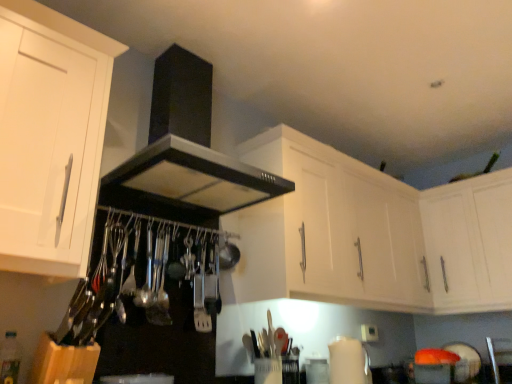
Measure the distance between point (x=495, y=269) and camera.

2.54 meters.

The width and height of the screenshot is (512, 384). What do you see at coordinates (50, 137) in the screenshot?
I see `white matte cabinet at left, the 3th cabinetry from the right` at bounding box center [50, 137].

The width and height of the screenshot is (512, 384). What are the coordinates of `white matte cabinet at left, which ranks as the first cabinetry in left-to-right order` in the screenshot? It's located at (50, 137).

What do you see at coordinates (370, 235) in the screenshot? I see `white matte cabinet at upper center, placed as the second cabinetry when sorted from right to left` at bounding box center [370, 235].

Where is `white matte cabinet at upper right, which appears as the 3th cabinetry when viewed from the left`? The width and height of the screenshot is (512, 384). white matte cabinet at upper right, which appears as the 3th cabinetry when viewed from the left is located at coordinates (469, 243).

Locate an element on the screen. The width and height of the screenshot is (512, 384). exhaust hood above the satin nickel spatula at center (from a real-world perspective) is located at coordinates (188, 146).

From the image's perspective, does black matte exhaust hood at upper center appear lower than satin nickel spatula at center?

No.

Is black matte exhaust hood at upper center wider than satin nickel spatula at center?

Yes, black matte exhaust hood at upper center is wider than satin nickel spatula at center.

Considering the relative sizes of black matte exhaust hood at upper center and satin nickel spatula at center in the image provided, is black matte exhaust hood at upper center taller than satin nickel spatula at center?

Indeed, black matte exhaust hood at upper center has a greater height compared to satin nickel spatula at center.

Is white matte cabinet at upper center, placed as the second cabinetry when sorted from right to left, facing towards black matte exhaust hood at upper center?

No, white matte cabinet at upper center, placed as the second cabinetry when sorted from right to left, is not aimed at black matte exhaust hood at upper center.

Is white matte cabinet at upper center, placed as the second cabinetry when sorted from right to left, shorter than black matte exhaust hood at upper center?

No, white matte cabinet at upper center, placed as the second cabinetry when sorted from right to left, is not shorter than black matte exhaust hood at upper center.

Is white matte cabinet at upper center, placed as the second cabinetry when sorted from right to left, not within black matte exhaust hood at upper center?

white matte cabinet at upper center, placed as the second cabinetry when sorted from right to left, lies outside black matte exhaust hood at upper center's area.

From a real-world perspective, is white matte cabinet at upper center, marked as the 2th cabinetry in a left-to-right arrangement, under black matte exhaust hood at upper center?

Yes.

In the image, is satin nickel spatula at center on the left side or the right side of black matte exhaust hood at upper center?

satin nickel spatula at center is to the left of black matte exhaust hood at upper center.

Between point (200, 272) and point (209, 156), which one is positioned behind?

The point (200, 272) is more distant.

Considering the positions of objects satin nickel spatula at center and black matte exhaust hood at upper center in the image provided, who is in front, satin nickel spatula at center or black matte exhaust hood at upper center?

Positioned in front is black matte exhaust hood at upper center.

From a real-world perspective, count 3rd cabinetrys downward from the black matte exhaust hood at upper center and point to it. Please provide its 2D coordinates.

[(469, 243)]

Considering the relative positions of black matte exhaust hood at upper center and white matte cabinet at upper right, which appears as the 3th cabinetry when viewed from the left, in the image provided, is black matte exhaust hood at upper center to the left of white matte cabinet at upper right, which appears as the 3th cabinetry when viewed from the left, from the viewer's perspective?

Yes, black matte exhaust hood at upper center is to the left of white matte cabinet at upper right, which appears as the 3th cabinetry when viewed from the left.

Considering the relative sizes of black matte exhaust hood at upper center and white matte cabinet at upper right, which appears as the 3th cabinetry when viewed from the left, in the image provided, is black matte exhaust hood at upper center smaller than white matte cabinet at upper right, which appears as the 3th cabinetry when viewed from the left,?

Actually, black matte exhaust hood at upper center might be larger than white matte cabinet at upper right, which appears as the 3th cabinetry when viewed from the left.

Is black matte exhaust hood at upper center thinner than white matte cabinet at upper right, the first cabinetry from the right?

No, black matte exhaust hood at upper center is not thinner than white matte cabinet at upper right, the first cabinetry from the right.

From a real-world perspective, is white matte cabinet at left, which ranks as the first cabinetry in left-to-right order, below black matte exhaust hood at upper center?

Yes, from a real-world perspective, white matte cabinet at left, which ranks as the first cabinetry in left-to-right order, is under black matte exhaust hood at upper center.

Is white matte cabinet at left, the 3th cabinetry from the right, with black matte exhaust hood at upper center?

white matte cabinet at left, the 3th cabinetry from the right, is not next to black matte exhaust hood at upper center, and they're not touching.

Which of these two, white matte cabinet at left, which ranks as the first cabinetry in left-to-right order, or black matte exhaust hood at upper center, is wider?

Wider between the two is black matte exhaust hood at upper center.

From the picture: Can you confirm if white matte cabinet at left, which ranks as the first cabinetry in left-to-right order, is positioned to the left of black matte exhaust hood at upper center?

Yes.

How much distance is there between white matte cabinet at upper right, the first cabinetry from the right, and satin nickel spatula at center?

white matte cabinet at upper right, the first cabinetry from the right, is 1.69 meters from satin nickel spatula at center.

Choose the correct answer: Is white matte cabinet at upper right, the first cabinetry from the right, inside satin nickel spatula at center or outside it?

The correct answer is: outside.

Does white matte cabinet at upper right, which appears as the 3th cabinetry when viewed from the left, appear on the right side of satin nickel spatula at center?

Indeed, white matte cabinet at upper right, which appears as the 3th cabinetry when viewed from the left, is positioned on the right side of satin nickel spatula at center.

Does white matte cabinet at upper right, which appears as the 3th cabinetry when viewed from the left, have a greater width compared to satin nickel spatula at center?

Yes.

From a real-world perspective, who is located lower, satin nickel spatula at center or white matte cabinet at upper right, the first cabinetry from the right?

satin nickel spatula at center, from a real-world perspective.

Between satin nickel spatula at center and white matte cabinet at upper right, the first cabinetry from the right, which one has more height?

white matte cabinet at upper right, the first cabinetry from the right, is taller.

Is satin nickel spatula at center aimed at white matte cabinet at upper right, the first cabinetry from the right?

No, satin nickel spatula at center is not oriented towards white matte cabinet at upper right, the first cabinetry from the right.

This screenshot has height=384, width=512. What are the coordinates of `silverware that is below the black matte exhaust hood at upper center (from the image's perspective)` in the screenshot? It's located at (202, 293).

From a real-world perspective, count 1st cabinetrys downward from the black matte exhaust hood at upper center and point to it. Please provide its 2D coordinates.

[(370, 235)]

Based on their spatial positions, is black matte exhaust hood at upper center or satin nickel spatula at center closer to white matte cabinet at upper center, marked as the 2th cabinetry in a left-to-right arrangement?

black matte exhaust hood at upper center lies closer to white matte cabinet at upper center, marked as the 2th cabinetry in a left-to-right arrangement, than the other object.

Considering their positions, is white matte cabinet at upper center, placed as the second cabinetry when sorted from right to left, positioned closer to black matte exhaust hood at upper center than white matte cabinet at upper right, the first cabinetry from the right?

white matte cabinet at upper center, placed as the second cabinetry when sorted from right to left, is positioned closer to the anchor black matte exhaust hood at upper center.

Estimate the real-world distances between objects in this image. Which object is further from white matte cabinet at left, the 3th cabinetry from the right, white matte cabinet at upper center, placed as the second cabinetry when sorted from right to left, or white matte cabinet at upper right, which appears as the 3th cabinetry when viewed from the left?

Among the two, white matte cabinet at upper right, which appears as the 3th cabinetry when viewed from the left, is located further to white matte cabinet at left, the 3th cabinetry from the right.

Considering their positions, is white matte cabinet at upper center, placed as the second cabinetry when sorted from right to left, positioned closer to black matte exhaust hood at upper center than satin nickel spatula at center?

The object closer to black matte exhaust hood at upper center is satin nickel spatula at center.

In the scene shown: Looking at the image, which one is located closer to white matte cabinet at upper center, placed as the second cabinetry when sorted from right to left, black matte exhaust hood at upper center or white matte cabinet at left, the 3th cabinetry from the right?

black matte exhaust hood at upper center lies closer to white matte cabinet at upper center, placed as the second cabinetry when sorted from right to left, than the other object.

Which object lies nearer to the anchor point white matte cabinet at upper right, the first cabinetry from the right, satin nickel spatula at center or white matte cabinet at left, the 3th cabinetry from the right?

The object closer to white matte cabinet at upper right, the first cabinetry from the right, is satin nickel spatula at center.

Which object lies nearer to the anchor point white matte cabinet at upper center, marked as the 2th cabinetry in a left-to-right arrangement, white matte cabinet at left, which ranks as the first cabinetry in left-to-right order, or black matte exhaust hood at upper center?

Based on the image, black matte exhaust hood at upper center appears to be nearer to white matte cabinet at upper center, marked as the 2th cabinetry in a left-to-right arrangement.

From the image, which object appears to be farther from white matte cabinet at upper center, marked as the 2th cabinetry in a left-to-right arrangement, black matte exhaust hood at upper center or white matte cabinet at upper right, the first cabinetry from the right?

black matte exhaust hood at upper center lies further to white matte cabinet at upper center, marked as the 2th cabinetry in a left-to-right arrangement, than the other object.

Find the location of a particular element. exhaust hood located between satin nickel spatula at center and white matte cabinet at upper right, the first cabinetry from the right, in the left-right direction is located at coordinates (188, 146).

Identify the location of cabinetry between black matte exhaust hood at upper center and white matte cabinet at upper right, the first cabinetry from the right. The image size is (512, 384). (370, 235).

Locate an element on the screen. cabinetry between white matte cabinet at left, which ranks as the first cabinetry in left-to-right order, and white matte cabinet at upper right, which appears as the 3th cabinetry when viewed from the left, from left to right is located at coordinates (370, 235).

Locate an element on the screen. Image resolution: width=512 pixels, height=384 pixels. exhaust hood located between white matte cabinet at left, which ranks as the first cabinetry in left-to-right order, and white matte cabinet at upper right, the first cabinetry from the right, in the left-right direction is located at coordinates pyautogui.click(x=188, y=146).